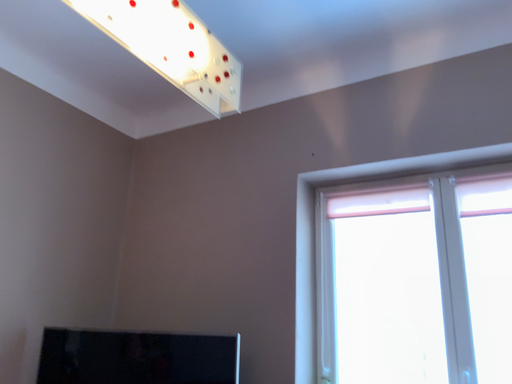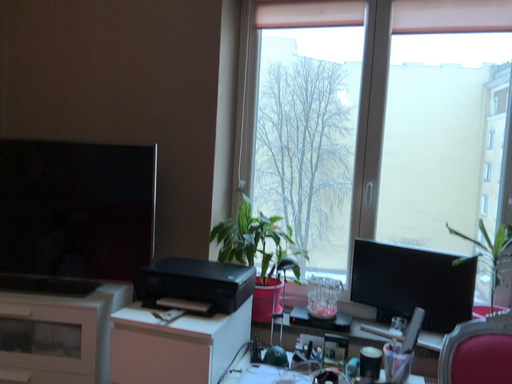
Question: How did the camera likely rotate when shooting the video?

Choices:
 (A) rotated left
 (B) rotated right

Answer: (B)